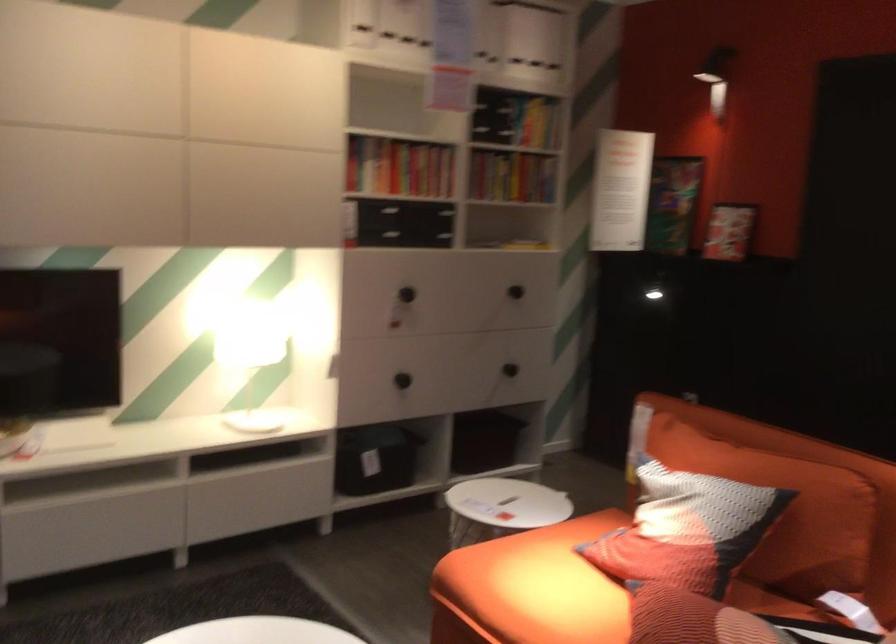
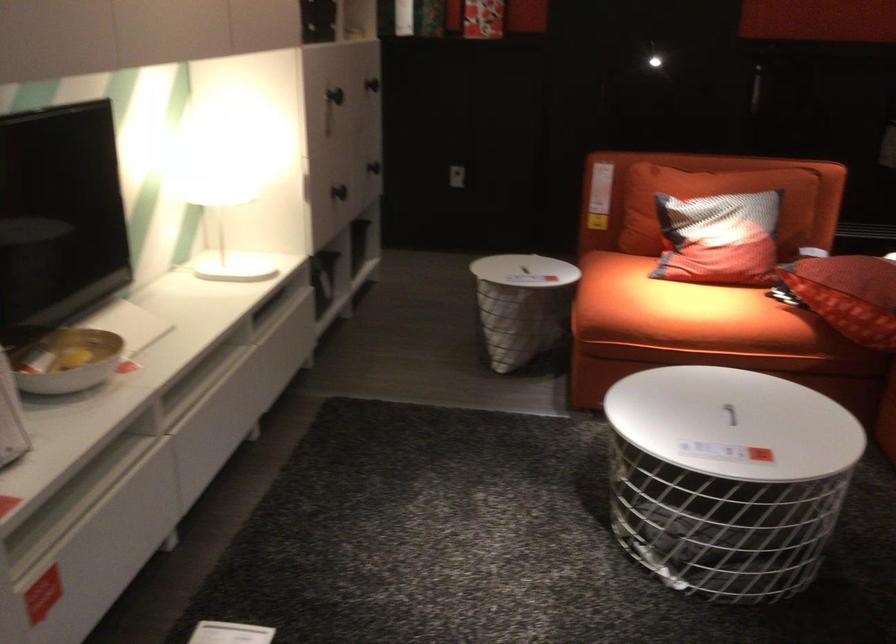
Locate, in the second image, the point that corresponds to (x=407, y=375) in the first image.

(339, 192)